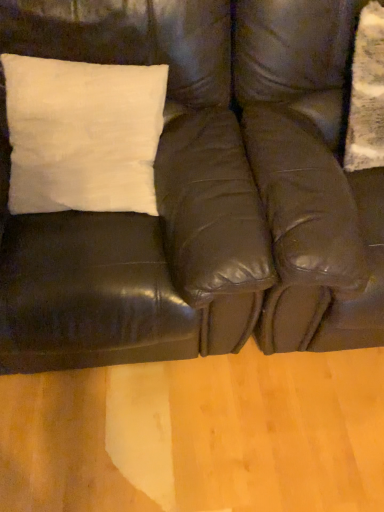
This screenshot has width=384, height=512. Describe the element at coordinates (202, 193) in the screenshot. I see `matte black leather couch at upper left` at that location.

At what (x,y) coordinates should I click in order to perform the action: click on matte black leather couch at upper left. Please return your answer as a coordinate pair (x, y). Looking at the image, I should click on (202, 193).

The image size is (384, 512). What are the coordinates of `matte black swivel chair at right` in the screenshot? It's located at (309, 175).

The width and height of the screenshot is (384, 512). What do you see at coordinates (309, 175) in the screenshot?
I see `matte black swivel chair at right` at bounding box center [309, 175].

This screenshot has width=384, height=512. Identify the location of matte black leather couch at upper left. (202, 193).

Would you say matte black swivel chair at right is to the left or to the right of matte black leather couch at upper left in the picture?

Clearly, matte black swivel chair at right is on the right of matte black leather couch at upper left in the image.

Between matte black swivel chair at right and matte black leather couch at upper left, which one is positioned in front?

matte black leather couch at upper left is in front.

Is point (286, 95) more distant than point (184, 211)?

Yes, point (286, 95) is behind point (184, 211).

From the image's perspective, which is above, matte black swivel chair at right or matte black leather couch at upper left?

matte black swivel chair at right appears higher in the image.

From a real-world perspective, which is physically below, matte black swivel chair at right or matte black leather couch at upper left?

From a 3D spatial view, matte black swivel chair at right is below.

Which of these two, matte black swivel chair at right or matte black leather couch at upper left, is thinner?

matte black leather couch at upper left.

Does matte black swivel chair at right have a lesser height compared to matte black leather couch at upper left?

In fact, matte black swivel chair at right may be taller than matte black leather couch at upper left.

Who is smaller, matte black swivel chair at right or matte black leather couch at upper left?

With smaller size is matte black swivel chair at right.

Is matte black swivel chair at right outside of matte black leather couch at upper left?

Indeed, matte black swivel chair at right is completely outside matte black leather couch at upper left.

Is matte black swivel chair at right with matte black leather couch at upper left?

matte black swivel chair at right is not next to matte black leather couch at upper left, and they're not touching.

From the picture: Is matte black swivel chair at right positioned with its back to matte black leather couch at upper left?

No.

How many degrees apart are the facing directions of matte black swivel chair at right and matte black leather couch at upper left?

The facing directions of matte black swivel chair at right and matte black leather couch at upper left are 0.000139 degrees apart.

The image size is (384, 512). I want to click on studio couch below the matte black swivel chair at right (from the image's perspective), so click(202, 193).

Can you confirm if matte black leather couch at upper left is positioned to the left of matte black swivel chair at right?

Correct, you'll find matte black leather couch at upper left to the left of matte black swivel chair at right.

Which is in front, matte black leather couch at upper left or matte black swivel chair at right?

matte black leather couch at upper left.

Considering the positions of point (167, 222) and point (356, 263), is point (167, 222) closer or farther from the camera than point (356, 263)?

Point (167, 222) is farther from the camera than point (356, 263).

From the image's perspective, between matte black leather couch at upper left and matte black swivel chair at right, who is located below?

From the image's view, matte black leather couch at upper left is below.

From a real-world perspective, which is physically below, matte black leather couch at upper left or matte black swivel chair at right?

In real-world perspective, matte black swivel chair at right is lower.

Does matte black leather couch at upper left have a lesser width compared to matte black swivel chair at right?

Correct, the width of matte black leather couch at upper left is less than that of matte black swivel chair at right.

Based on the photo, between matte black leather couch at upper left and matte black swivel chair at right, which one has less height?

matte black leather couch at upper left is shorter.

Considering the sizes of objects matte black leather couch at upper left and matte black swivel chair at right in the image provided, who is bigger, matte black leather couch at upper left or matte black swivel chair at right?

With larger size is matte black leather couch at upper left.

Consider the image. Choose the correct answer: Is matte black leather couch at upper left inside matte black swivel chair at right or outside it?

matte black leather couch at upper left is not enclosed by matte black swivel chair at right.

Are matte black leather couch at upper left and matte black swivel chair at right far apart?

No, matte black leather couch at upper left is in close proximity to matte black swivel chair at right.

Is matte black leather couch at upper left facing towards matte black swivel chair at right?

No, matte black leather couch at upper left is not turned towards matte black swivel chair at right.

Looking at this image, how different are the orientations of matte black leather couch at upper left and matte black swivel chair at right in degrees?

The angular difference between matte black leather couch at upper left and matte black swivel chair at right is 0.000139 degrees.

At what (x,y) coordinates should I click in order to perform the action: click on swivel chair lying behind the matte black leather couch at upper left. Please return your answer as a coordinate pair (x, y). The width and height of the screenshot is (384, 512). Looking at the image, I should click on (309, 175).

Find the location of `swivel chair on the right of matte black leather couch at upper left`. swivel chair on the right of matte black leather couch at upper left is located at coordinates (309, 175).

I want to click on swivel chair behind the matte black leather couch at upper left, so click(x=309, y=175).